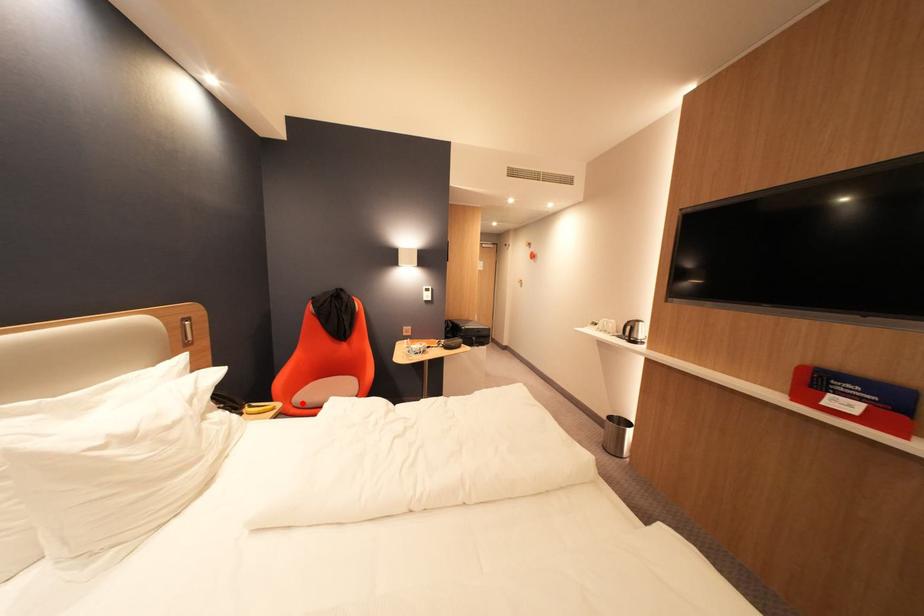
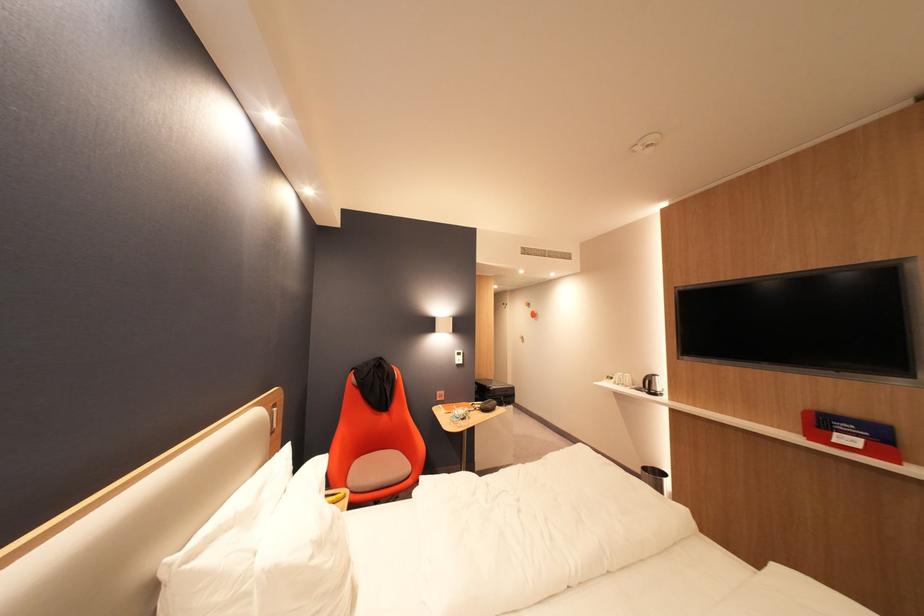
Find the pixel in the second image that matches the highlighted location in the first image.

(359, 488)